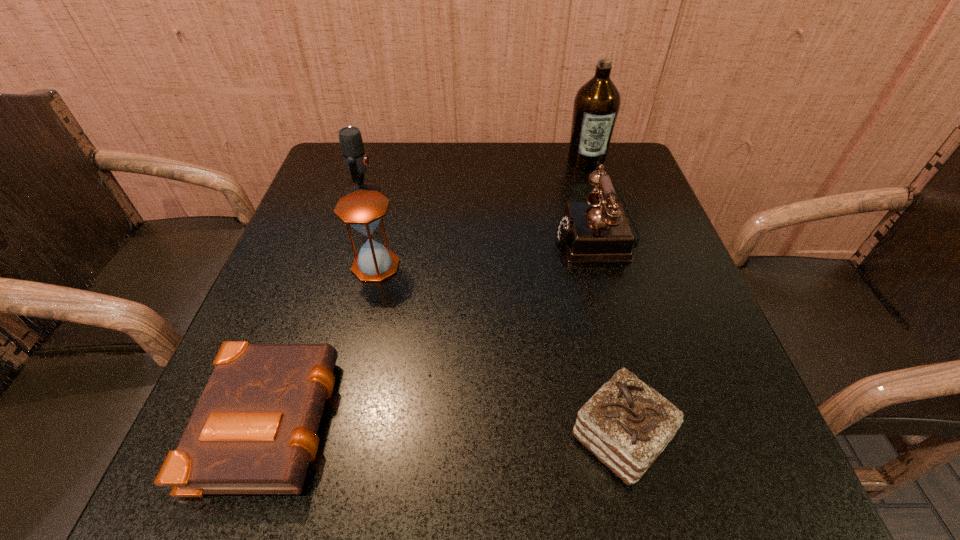
At what (x,y) coordinates should I click in order to perform the action: click on empty space that is in between the telephone and the fifth tallest object. Please return your answer as a coordinate pair (x, y). Image resolution: width=960 pixels, height=540 pixels. Looking at the image, I should click on (609, 338).

Where is `free point between the fifth tallest object and the telephone`? free point between the fifth tallest object and the telephone is located at coordinates (609, 338).

I want to click on vacant space that's between the second shortest object and the Bible, so [446, 427].

This screenshot has height=540, width=960. In order to click on vacant area that lies between the telephone and the fifth nearest object in this screenshot , I will do `click(480, 214)`.

The height and width of the screenshot is (540, 960). I want to click on object that is the second closest to the second farthest object, so click(x=597, y=231).

Locate which object is the fourth closest to the hourglass. Please provide its 2D coordinates. Your answer should be formatted as a tuple, i.e. [(x, y)], where the tuple contains the x and y coordinates of a point satisfying the conditions above.

[(626, 424)]

You are a GUI agent. You are given a task and a screenshot of the screen. Output one action in this format:
    pyautogui.click(x=<x>, y=<y>)
    Task: Click on the free location that satisfies the following two spatial constraints: 1. on the back side of the chocolate cake; 2. on the side of the microphone with the red ring
    This screenshot has width=960, height=540.
    Given the screenshot: What is the action you would take?
    pyautogui.click(x=564, y=192)

The width and height of the screenshot is (960, 540). Find the location of `free spot that satisfies the following two spatial constraints: 1. on the front side of the chocolate cake; 2. on the left side of the hourglass`. free spot that satisfies the following two spatial constraints: 1. on the front side of the chocolate cake; 2. on the left side of the hourglass is located at coordinates (336, 438).

Identify the location of free region that satisfies the following two spatial constraints: 1. on the label of the tallest object; 2. on the dial of the telephone. The height and width of the screenshot is (540, 960). (610, 237).

Where is `vacant space that satisfies the following two spatial constraints: 1. on the label of the tallest object; 2. on the spine side of the Bible`? The height and width of the screenshot is (540, 960). vacant space that satisfies the following two spatial constraints: 1. on the label of the tallest object; 2. on the spine side of the Bible is located at coordinates (665, 415).